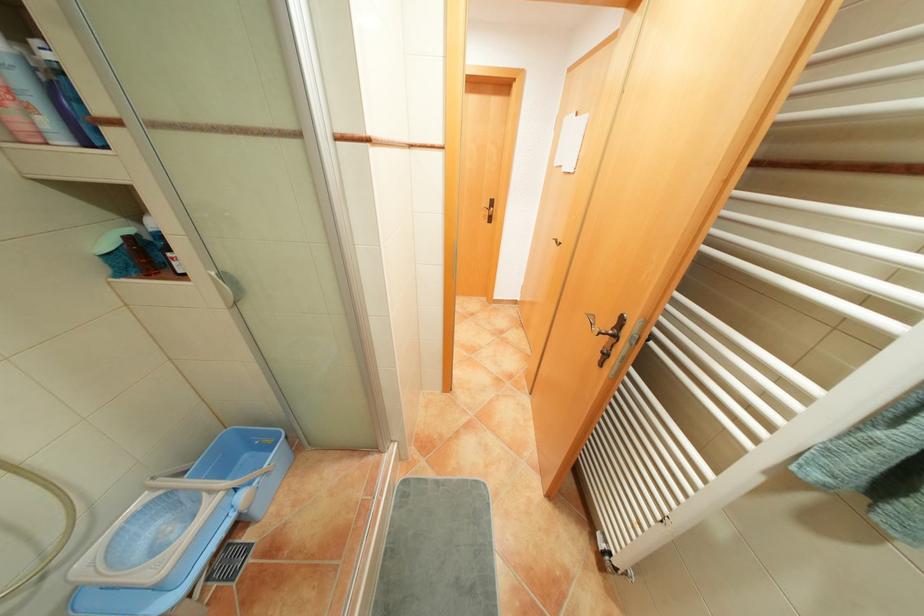
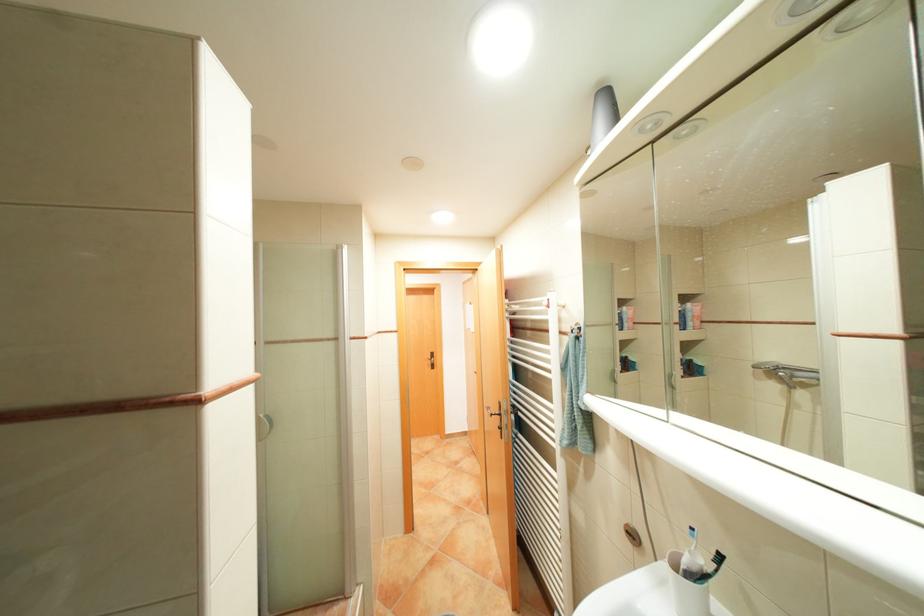
In the second image, find the point that corresponds to point (626, 336) in the first image.

(509, 413)